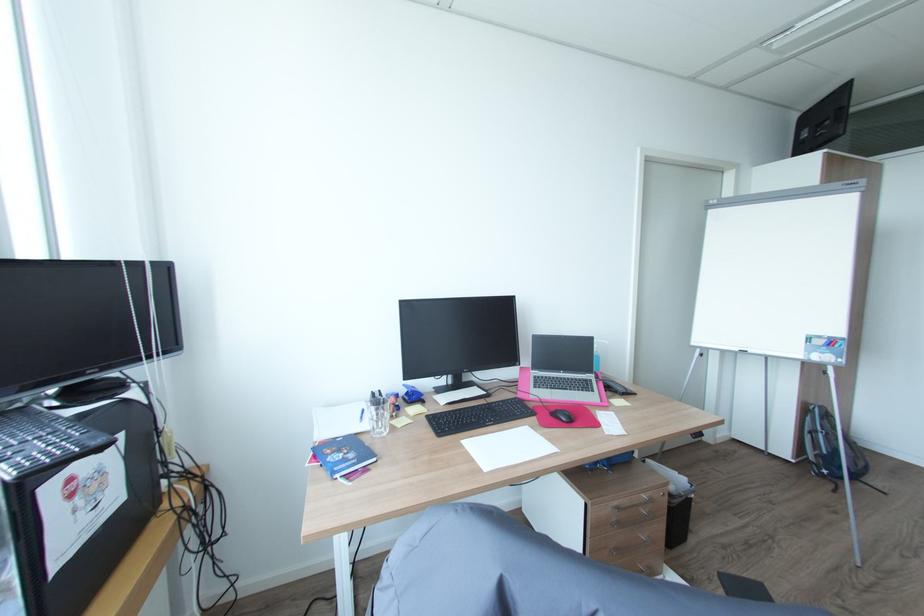
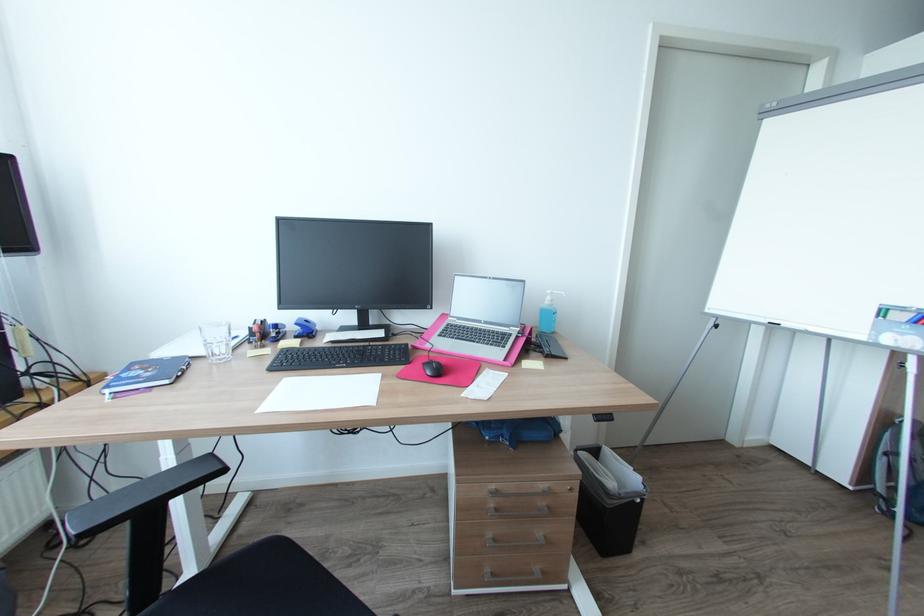
Where in the second image is the point corresponding to point 380,459 from the first image?

(171, 381)